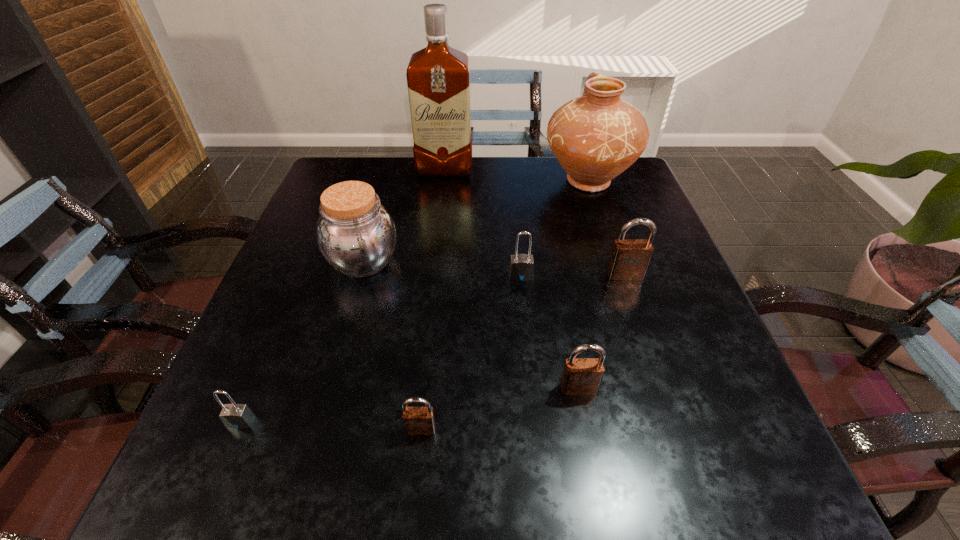
The image size is (960, 540). In the image, there is a desktop. Identify the location of vacant region at the near left corner. (260, 471).

The image size is (960, 540). Find the location of `free space that is in between the smaller gray padlock and the pottery`. free space that is in between the smaller gray padlock and the pottery is located at coordinates (415, 301).

Where is `vacant space that's between the pottery and the farther gray padlock`? vacant space that's between the pottery and the farther gray padlock is located at coordinates (554, 228).

Image resolution: width=960 pixels, height=540 pixels. What are the coordinates of `vacant space that is in between the tallest object and the second padlock from left to right` in the screenshot? It's located at (433, 299).

The image size is (960, 540). Find the location of `free space between the tallest padlock and the liquor`. free space between the tallest padlock and the liquor is located at coordinates (535, 222).

Identify the location of vacant space that's between the biggest brown padlock and the leftmost brown padlock. The image size is (960, 540). (x=523, y=352).

Find the location of a particular element. This screenshot has width=960, height=540. free space between the fourth tallest object and the fourth padlock from right to left is located at coordinates (523, 352).

Locate an element on the screen. vacant space in between the second padlock from left to right and the tallest padlock is located at coordinates (523, 352).

Find the location of `free area in between the second brown padlock from right to left and the smallest brown padlock`. free area in between the second brown padlock from right to left and the smallest brown padlock is located at coordinates [x=500, y=409].

Locate an element on the screen. The image size is (960, 540). vacant point located between the leftmost brown padlock and the third nearest object is located at coordinates (500, 409).